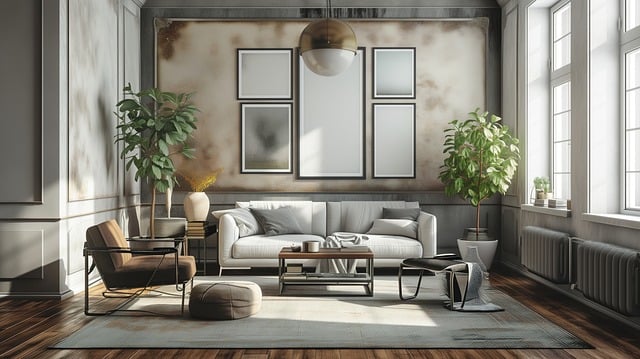
This screenshot has width=640, height=359. Identify the location of places to sit. (144, 264), (282, 229), (383, 233), (436, 263).